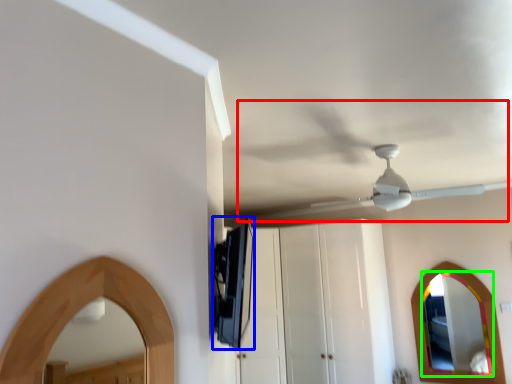
Question: Estimate the real-world distances between objects in this image. Which object is farther from fan (highlighted by a red box), appliance (highlighted by a blue box) or mirror (highlighted by a green box)?

Choices:
 (A) appliance
 (B) mirror

Answer: (B)